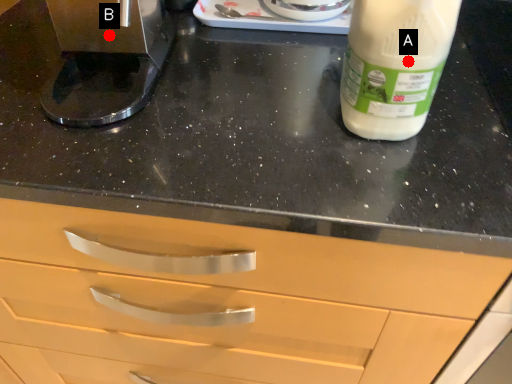
Question: Two points are circled on the image, labeled by A and B beside each circle. Which point is closer to the camera?

Choices:
 (A) A is closer
 (B) B is closer

Answer: (A)